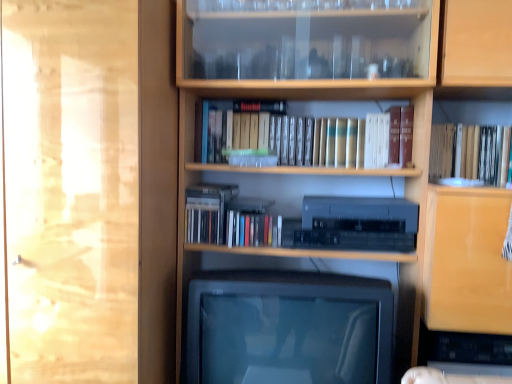
Question: Does wooden bookcase at center contain satin black stereo at center?

Choices:
 (A) no
 (B) yes

Answer: (B)

Question: Considering the relative positions of wooden bookcase at center and satin black stereo at center in the image provided, is wooden bookcase at center to the right of satin black stereo at center from the viewer's perspective?

Choices:
 (A) yes
 (B) no

Answer: (A)

Question: Can we say wooden bookcase at center lies outside satin black stereo at center?

Choices:
 (A) no
 (B) yes

Answer: (B)

Question: Is wooden bookcase at center oriented towards satin black stereo at center?

Choices:
 (A) no
 (B) yes

Answer: (B)

Question: Is wooden bookcase at center taller than satin black stereo at center?

Choices:
 (A) yes
 (B) no

Answer: (A)

Question: Is wooden bookcase at center wider than satin black stereo at center?

Choices:
 (A) no
 (B) yes

Answer: (B)

Question: Is transparent glass door at left oriented towards wooden bookcase at center?

Choices:
 (A) no
 (B) yes

Answer: (A)

Question: Would you say transparent glass door at left contains wooden bookcase at center?

Choices:
 (A) yes
 (B) no

Answer: (B)

Question: From a real-world perspective, is transparent glass door at left physically below wooden bookcase at center?

Choices:
 (A) no
 (B) yes

Answer: (B)

Question: Is transparent glass door at left smaller than wooden bookcase at center?

Choices:
 (A) no
 (B) yes

Answer: (B)

Question: Considering the relative sizes of transparent glass door at left and wooden bookcase at center in the image provided, is transparent glass door at left taller than wooden bookcase at center?

Choices:
 (A) yes
 (B) no

Answer: (B)

Question: From a real-world perspective, is transparent glass door at left over wooden bookcase at center?

Choices:
 (A) yes
 (B) no

Answer: (B)

Question: Is wooden bookcase at center next to transparent glass door at left and touching it?

Choices:
 (A) yes
 (B) no

Answer: (B)